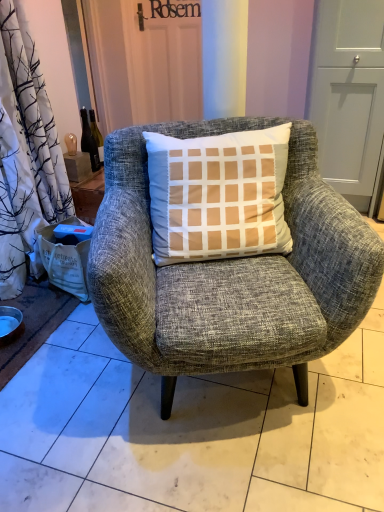
Where is `free space in front of white paper bag at lower left`? Image resolution: width=384 pixels, height=512 pixels. free space in front of white paper bag at lower left is located at coordinates (61, 324).